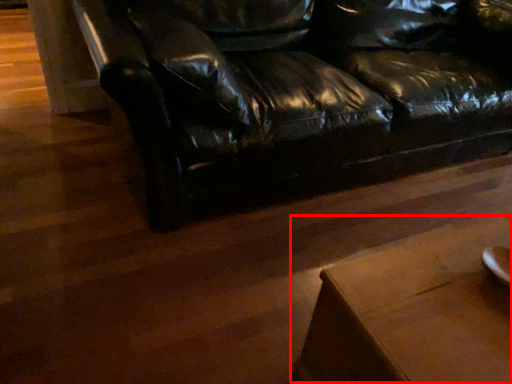
Question: Where is table (annotated by the red box) located in relation to studio couch in the image?

Choices:
 (A) left
 (B) right

Answer: (B)